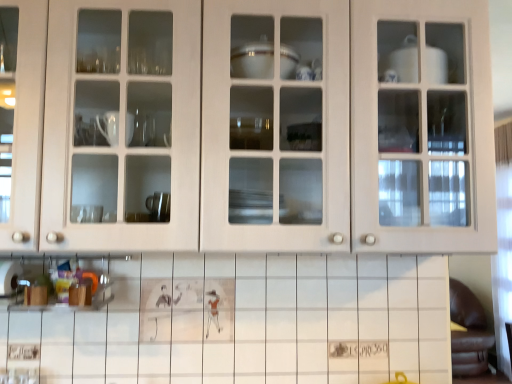
What do you see at coordinates (273, 127) in the screenshot?
I see `white matte cabinet at upper center` at bounding box center [273, 127].

You are a GUI agent. You are given a task and a screenshot of the screen. Output one action in this format:
    pyautogui.click(x=<x>, y=<y>)
    Task: Click on the white matte cabinet at upper center
    This screenshot has width=512, height=384.
    Given the screenshot: What is the action you would take?
    pyautogui.click(x=273, y=127)

This screenshot has width=512, height=384. What are the coordinates of `white matte cabinet at upper center` in the screenshot? It's located at (273, 127).